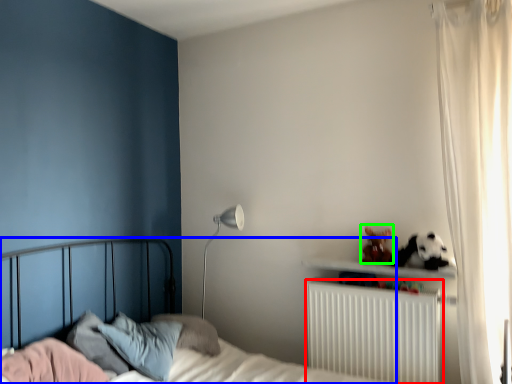
Question: Estimate the real-world distances between objects in this image. Which object is farther from radiator (highlighted by a red box), bed (highlighted by a blue box) or stuff (highlighted by a green box)?

Choices:
 (A) bed
 (B) stuff

Answer: (A)